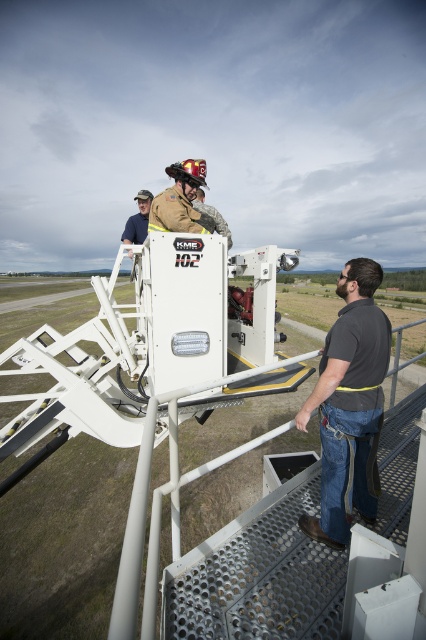
Question: Considering the relative positions of dark gray shirt at center and firefighter helmet at center in the image provided, where is dark gray shirt at center located with respect to firefighter helmet at center?

Choices:
 (A) above
 (B) below

Answer: (B)

Question: Is dark gray shirt at center further to camera compared to firefighter helmet at center?

Choices:
 (A) no
 (B) yes

Answer: (A)

Question: Which point appears closest to the camera in this image?

Choices:
 (A) (196, 177)
 (B) (328, 476)

Answer: (B)

Question: Does dark gray shirt at center come behind firefighter helmet at center?

Choices:
 (A) no
 (B) yes

Answer: (A)